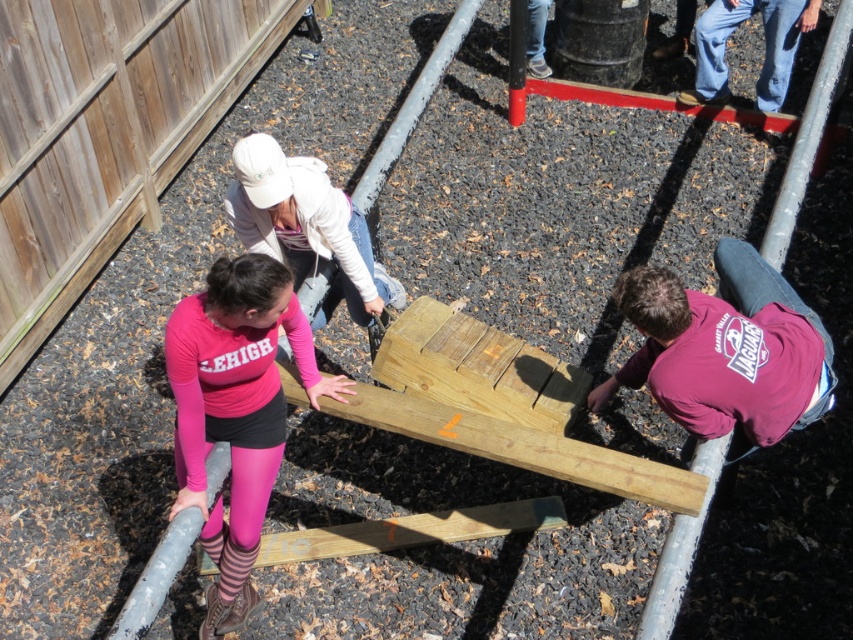
Where is `maroon jersey at lower right`? maroon jersey at lower right is located at coordinates (726, 349).

Does maroon jersey at lower right appear on the left side of wooden plank at center?

No, maroon jersey at lower right is not to the left of wooden plank at center.

The image size is (853, 640). I want to click on maroon jersey at lower right, so click(726, 349).

Does point (761, 406) come farther from viewer compared to point (381, 273)?

No, it is not.

Is maroon jersey at lower right shorter than white matte jacket at upper center?

No, maroon jersey at lower right is not shorter than white matte jacket at upper center.

This screenshot has width=853, height=640. Describe the element at coordinates (726, 349) in the screenshot. I see `maroon jersey at lower right` at that location.

Where is `maroon jersey at lower right`? Image resolution: width=853 pixels, height=640 pixels. maroon jersey at lower right is located at coordinates (726, 349).

Can you confirm if pink matte leggings at lower left is positioned to the right of blue jeans at upper right?

In fact, pink matte leggings at lower left is to the left of blue jeans at upper right.

Which is behind, point (265, 298) or point (706, 80)?

Positioned behind is point (706, 80).

You are a GUI agent. You are given a task and a screenshot of the screen. Output one action in this format:
    pyautogui.click(x=<x>, y=<y>)
    Task: Click on the pink matte leggings at lower left
    
    Given the screenshot: What is the action you would take?
    pyautogui.click(x=236, y=410)